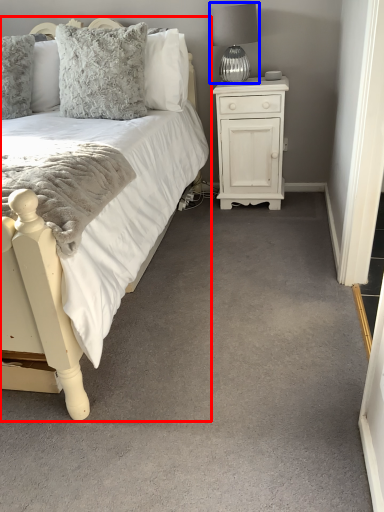
Question: Among these objects, which one is nearest to the camera, bed (highlighted by a red box) or table lamp (highlighted by a blue box)?

Choices:
 (A) bed
 (B) table lamp

Answer: (A)